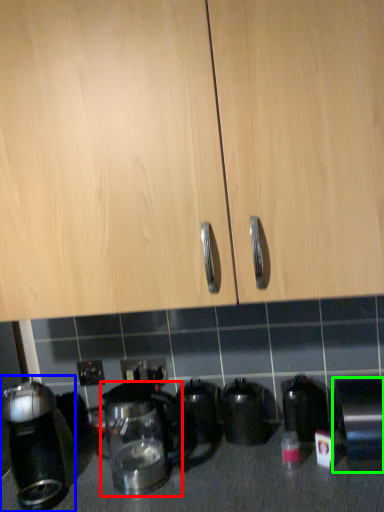
Question: Considering the real-world distances, which object is farthest from kitchen appliance (highlighted by a red box)? kitchen appliance (highlighted by a blue box) or kitchen appliance (highlighted by a green box)?

Choices:
 (A) kitchen appliance
 (B) kitchen appliance

Answer: (B)